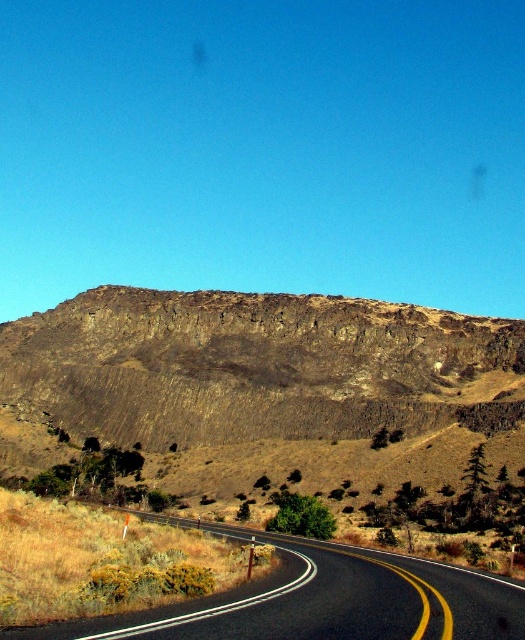
Question: Which point appears farthest from the camera in this image?

Choices:
 (A) (512, 330)
 (B) (278, 621)

Answer: (A)

Question: Is brown rocky hill at upper center to the left of black asphalt road at center from the viewer's perspective?

Choices:
 (A) yes
 (B) no

Answer: (A)

Question: Does brown rocky hill at upper center appear on the right side of black asphalt road at center?

Choices:
 (A) yes
 (B) no

Answer: (B)

Question: Is brown rocky hill at upper center bigger than black asphalt road at center?

Choices:
 (A) yes
 (B) no

Answer: (A)

Question: Which point is closer to the camera?

Choices:
 (A) brown rocky hill at upper center
 (B) black asphalt road at center

Answer: (B)